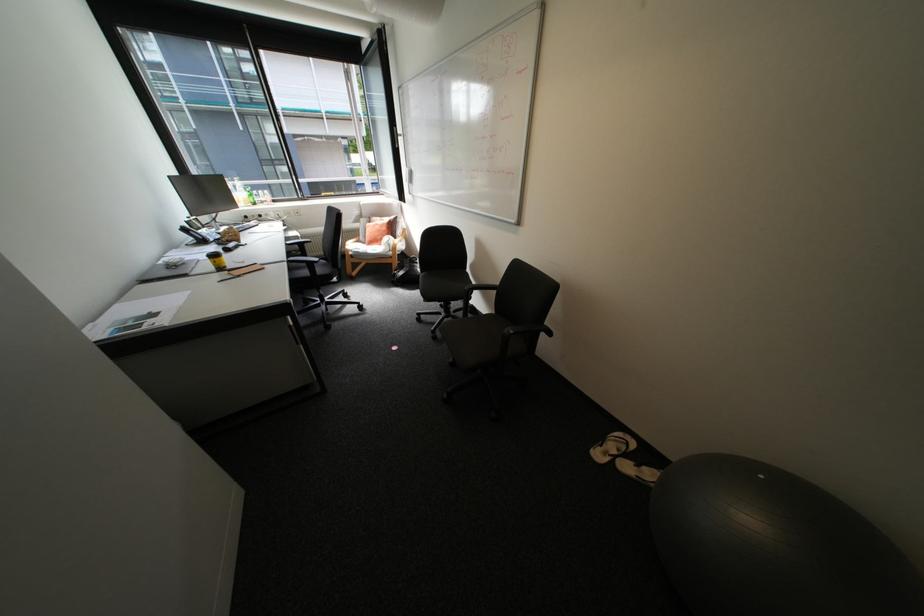
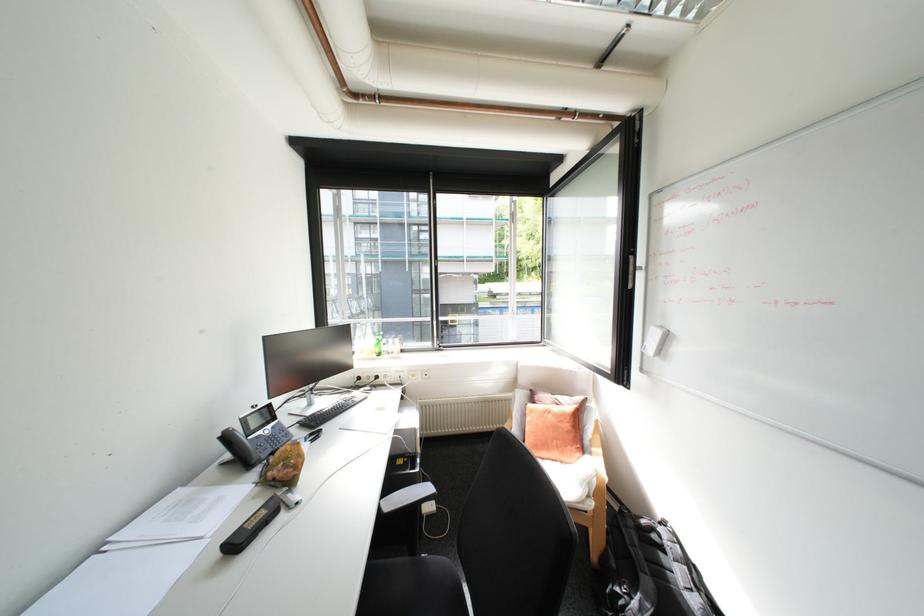
In the second image, find the point that corresponds to [408,272] in the first image.

(640, 598)